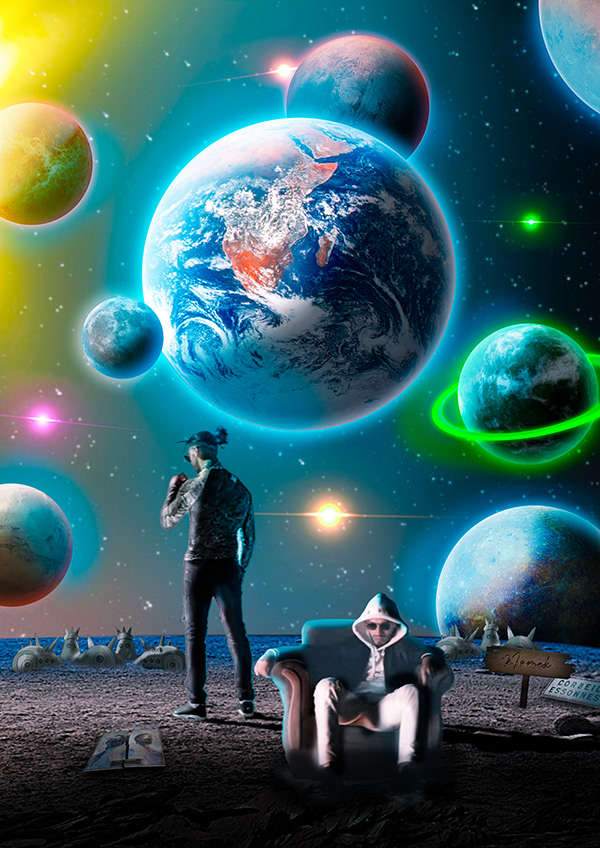
The width and height of the screenshot is (600, 848). Find the location of `armchair`. armchair is located at coordinates (299, 717).